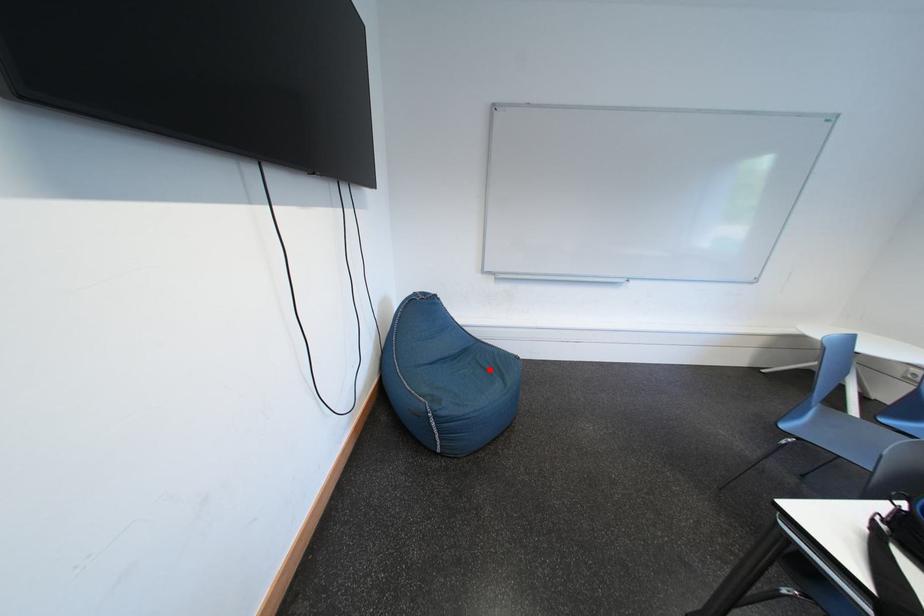
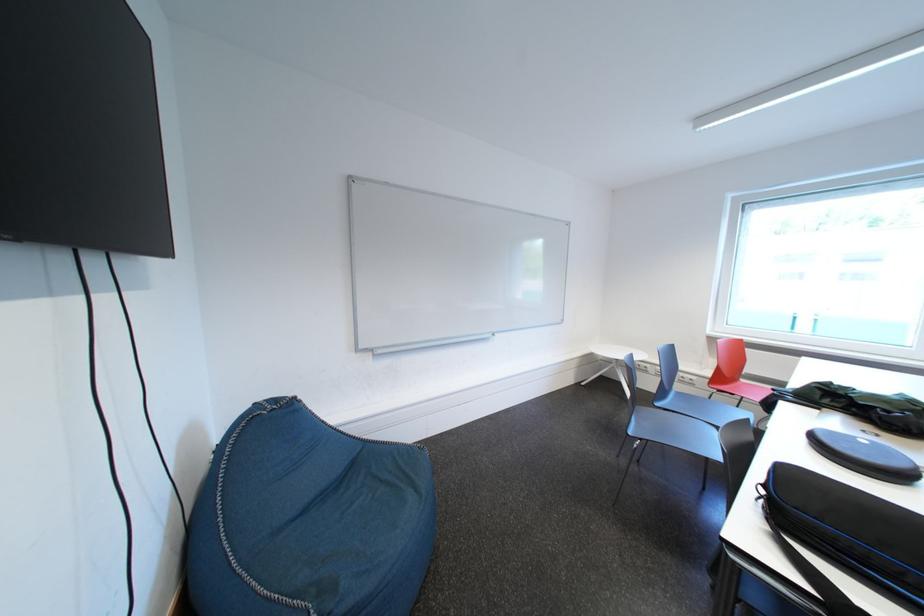
Question: I am providing you with two images of the same scene from different viewpoints. In image1, a red point is highlighted. Considering the same 3D point in image2, which of the following is correct?

Choices:
 (A) It is closer
 (B) It is farther

Answer: (B)